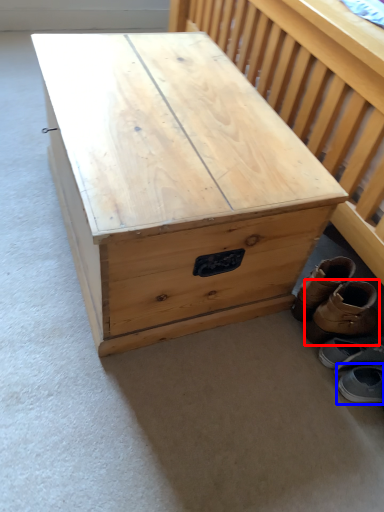
Question: Which of the following is the closest to the observer, footwear (highlighted by a red box) or footwear (highlighted by a blue box)?

Choices:
 (A) footwear
 (B) footwear

Answer: (B)